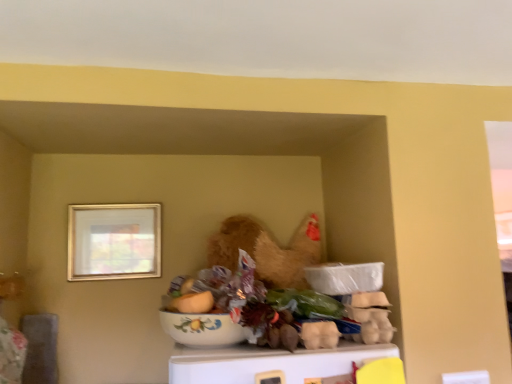
Question: From the image's perspective, relative to gold metallic picture frame at upper left, is white glossy bowl at center above or below?

Choices:
 (A) above
 (B) below

Answer: (B)

Question: From a real-world perspective, is white glossy bowl at center positioned above or below gold metallic picture frame at upper left?

Choices:
 (A) above
 (B) below

Answer: (B)

Question: Which object is positioned closest to the gold metallic picture frame at upper left?

Choices:
 (A) white glossy bowl at center
 (B) floral ceramic bowl at center, the 2th food in the bottom-to-top sequence
 (C) white cardboard egg carton at center, positioned as the first food in bottom-to-top order

Answer: (A)

Question: Which is nearer to the gold metallic picture frame at upper left?

Choices:
 (A) floral ceramic bowl at center, the 2th food in the bottom-to-top sequence
 (B) white glossy bowl at center
 (C) white cardboard egg carton at center, the 2th food in the top-to-bottom sequence

Answer: (B)